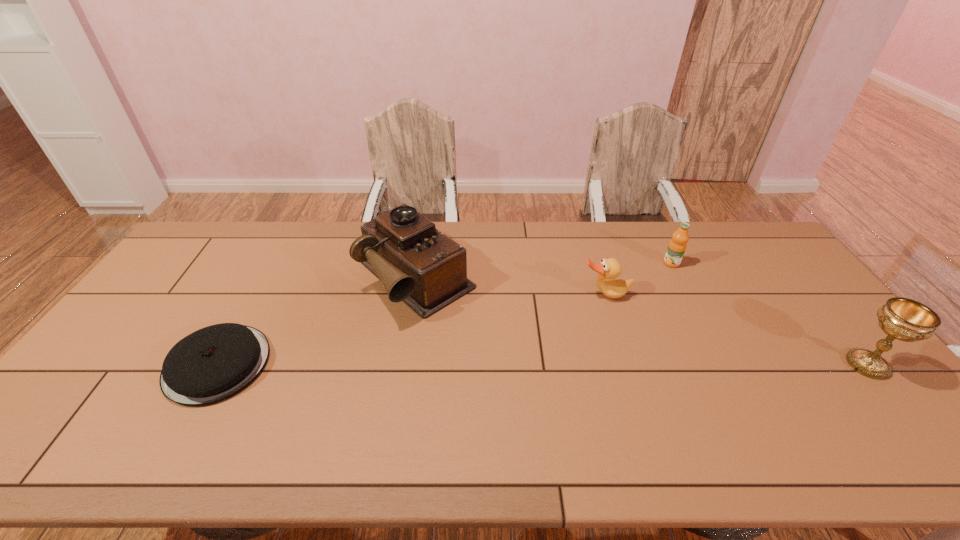
Find the location of a particular element. This screenshot has height=540, width=960. free space on the desktop that is between the leftmost object and the rightmost object and is positioned on the beak of the duck is located at coordinates (632, 364).

This screenshot has height=540, width=960. Find the location of `vacant space on the desktop that is between the shortest object and the rightmost object and is positioned on the horn of the phonograph_record`. vacant space on the desktop that is between the shortest object and the rightmost object and is positioned on the horn of the phonograph_record is located at coordinates (520, 364).

At what (x,y) coordinates should I click in order to perform the action: click on free spot on the desktop that is between the pancake and the chalice and is positioned on the label of the orange juice. Please return your answer as a coordinate pair (x, y). Looking at the image, I should click on (522, 364).